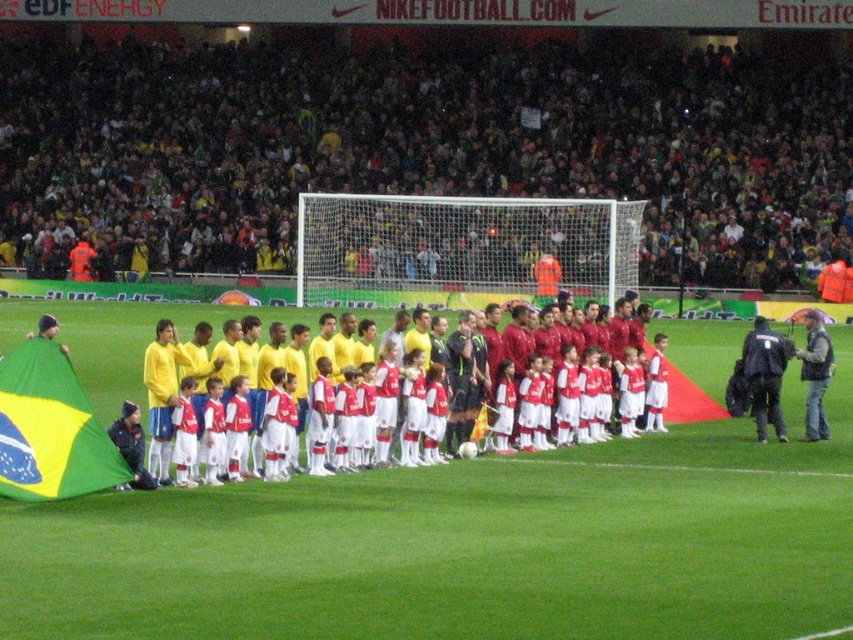
You are a drone operator trying to capture a closeup of the two points marked in the image. The first point is at coordinate point (824,474) and the second point is at coordinate point (1,486). Which point would require you to adjust your drone closer to the stadium to get a better shot?

Point (824,474) is further to the viewer than point (1,486), so you would need to adjust your drone closer to the stadium to capture point (824,474) for a better shot.